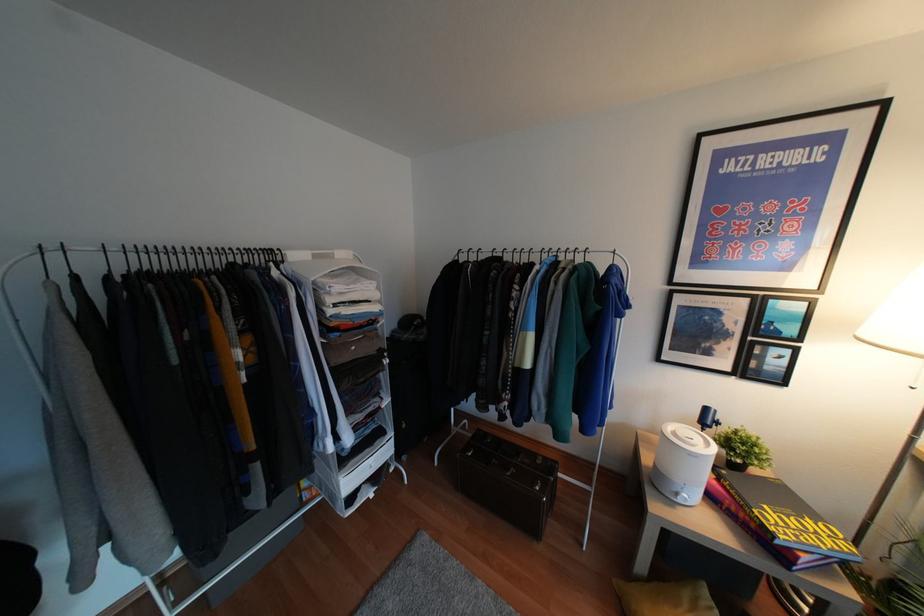
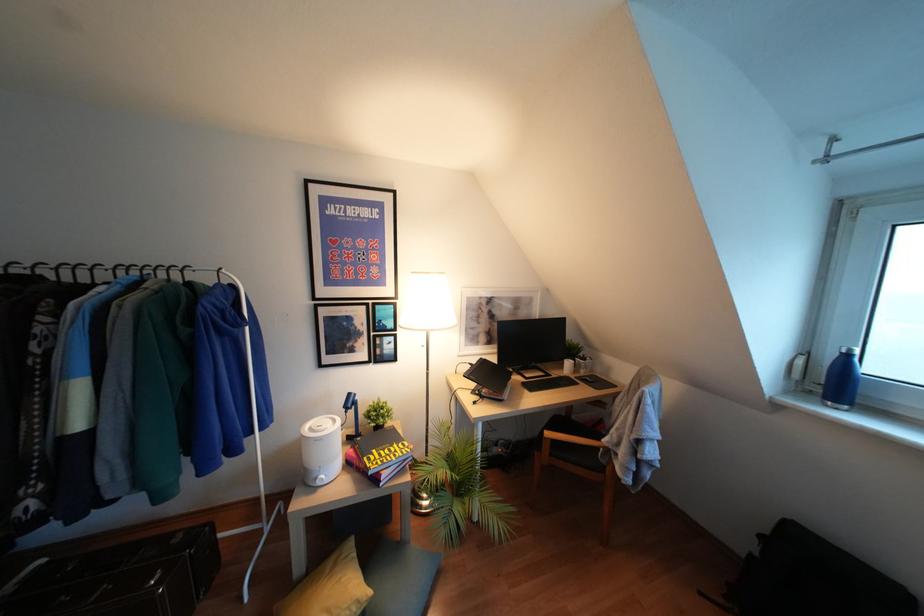
Question: How did the camera likely rotate?

Choices:
 (A) Left
 (B) Right
 (C) Up
 (D) Down

Answer: (B)